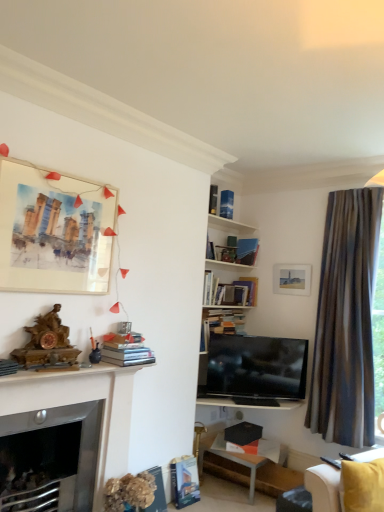
Question: Would you say matte white picture frame at upper right, marked as the second picture frame in a left-to-right arrangement, is outside brown striped curtain at right?

Choices:
 (A) yes
 (B) no

Answer: (A)

Question: From the image's perspective, does matte white picture frame at upper right, acting as the 1th picture frame starting from the right, appear higher than brown striped curtain at right?

Choices:
 (A) no
 (B) yes

Answer: (B)

Question: Is matte white picture frame at upper right, the second picture frame in the front-to-back sequence, oriented towards brown striped curtain at right?

Choices:
 (A) no
 (B) yes

Answer: (A)

Question: From the image's perspective, would you say matte white picture frame at upper right, the second picture frame in the front-to-back sequence, is shown under brown striped curtain at right?

Choices:
 (A) yes
 (B) no

Answer: (B)

Question: Is brown striped curtain at right located within matte white picture frame at upper right, marked as the second picture frame in a left-to-right arrangement?

Choices:
 (A) no
 (B) yes

Answer: (A)

Question: Does matte white picture frame at upper right, the second picture frame in the front-to-back sequence, have a greater height compared to brown striped curtain at right?

Choices:
 (A) no
 (B) yes

Answer: (A)

Question: Is hardcover book at lower center, which is the third book in bottom-to-top order, not within matte white picture frame at upper right, the 1th picture frame positioned from the back?

Choices:
 (A) yes
 (B) no

Answer: (A)

Question: From a real-world perspective, does hardcover book at lower center, which is counted as the sixth book, starting from the top, sit lower than matte white picture frame at upper right, marked as the second picture frame in a left-to-right arrangement?

Choices:
 (A) no
 (B) yes

Answer: (B)

Question: Considering the relative sizes of hardcover book at lower center, which is the third book in bottom-to-top order, and matte white picture frame at upper right, acting as the 1th picture frame starting from the right, in the image provided, is hardcover book at lower center, which is the third book in bottom-to-top order, wider than matte white picture frame at upper right, acting as the 1th picture frame starting from the right,?

Choices:
 (A) no
 (B) yes

Answer: (B)

Question: Is hardcover book at lower center, which is the third book in bottom-to-top order, not close to matte white picture frame at upper right, acting as the 1th picture frame starting from the right?

Choices:
 (A) no
 (B) yes

Answer: (B)

Question: Does hardcover book at lower center, which is the third book in bottom-to-top order, appear on the right side of matte white picture frame at upper right, acting as the 1th picture frame starting from the right?

Choices:
 (A) no
 (B) yes

Answer: (A)

Question: Considering the relative sizes of hardcover book at lower center, which is counted as the sixth book, starting from the top, and matte white picture frame at upper right, the second picture frame in the front-to-back sequence, in the image provided, is hardcover book at lower center, which is counted as the sixth book, starting from the top, taller than matte white picture frame at upper right, the second picture frame in the front-to-back sequence,?

Choices:
 (A) yes
 (B) no

Answer: (A)

Question: Is hardcover book at lower center, the second book from the bottom, at the left side of hardcover book at lower center, acting as the eighth book starting from the top?

Choices:
 (A) no
 (B) yes

Answer: (A)